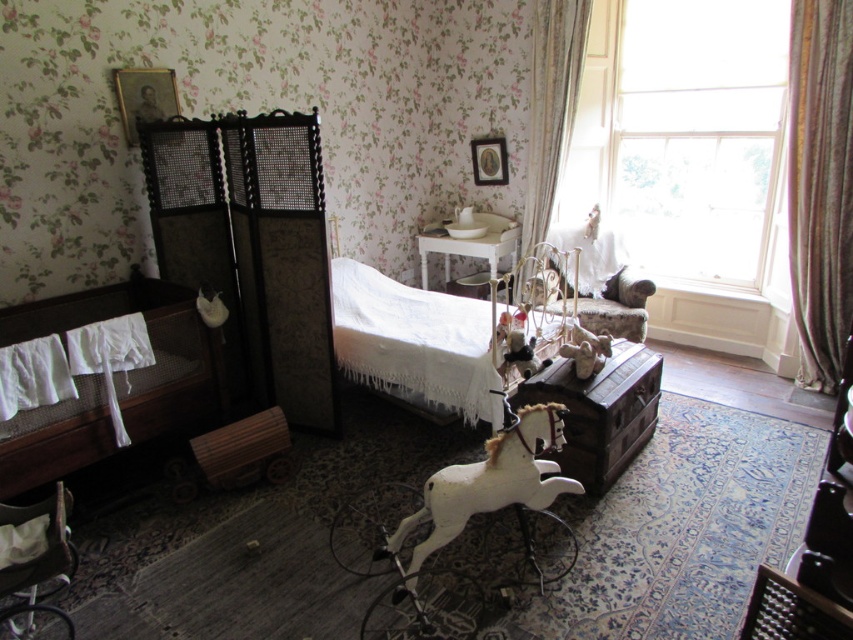
In the scene shown: Can you confirm if silky beige curtain at right is positioned to the left of white glossy table at center?

No, silky beige curtain at right is not to the left of white glossy table at center.

In the scene shown: Which is more to the right, silky beige curtain at right or white glossy table at center?

silky beige curtain at right is more to the right.

Image resolution: width=853 pixels, height=640 pixels. What are the coordinates of `silky beige curtain at right` in the screenshot? It's located at (820, 186).

Is transparent glass window at upper right positioned in front of white plastic baby carriage at lower left?

No, transparent glass window at upper right is behind white plastic baby carriage at lower left.

Measure the distance between point [677,273] and camera.

Point [677,273] and camera are 16.33 feet apart from each other.

The height and width of the screenshot is (640, 853). Find the location of `transparent glass window at upper right`. transparent glass window at upper right is located at coordinates pos(699,134).

Is white wooden baby carriage at center positioned before floral fabric curtain at right?

Yes.

Identify the location of white wooden baby carriage at center. (463, 528).

Find the location of a particular element. white wooden baby carriage at center is located at coordinates (463, 528).

Find the location of a particular element. white wooden baby carriage at center is located at coordinates (x=463, y=528).